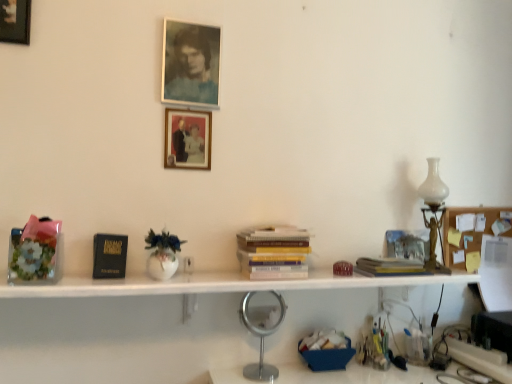
Question: Relative to wooden picture frame at upper left, arranged as the first picture frame when viewed from the left, is wooden memo board at right in front or behind?

Choices:
 (A) front
 (B) behind

Answer: (B)

Question: Considering the positions of wooden memo board at right and wooden picture frame at upper left, which is the third picture frame in back-to-front order, in the image, is wooden memo board at right wider or thinner than wooden picture frame at upper left, which is the third picture frame in back-to-front order,?

Choices:
 (A) thin
 (B) wide

Answer: (A)

Question: Estimate the real-world distances between objects in this image. Which object is farther from the wooden picture frame at upper left, which is the third picture frame from right to left?

Choices:
 (A) matte glass photo frame at upper center, the third picture frame in the left-to-right sequence
 (B) white matte bookshelf at center
 (C) silver metallic table lamp at center, which appears as the 1th table lamp when ordered from the bottom
 (D) black matte paperback book at left
 (E) white glass table lamp at right, marked as the 1th table lamp in a top-to-bottom arrangement

Answer: (E)

Question: Estimate the real-world distances between objects in this image. Which object is closer to the matte wooden picture frame at center, positioned as the second picture frame in right-to-left order?

Choices:
 (A) silver metallic table lamp at center, the first table lamp from the front
 (B) matte glass photo frame at upper center, the second picture frame viewed from the back
 (C) hardcover book at center, the first book from the right
 (D) wooden memo board at right
 (E) wooden picture frame at upper left, which is the third picture frame from right to left

Answer: (B)